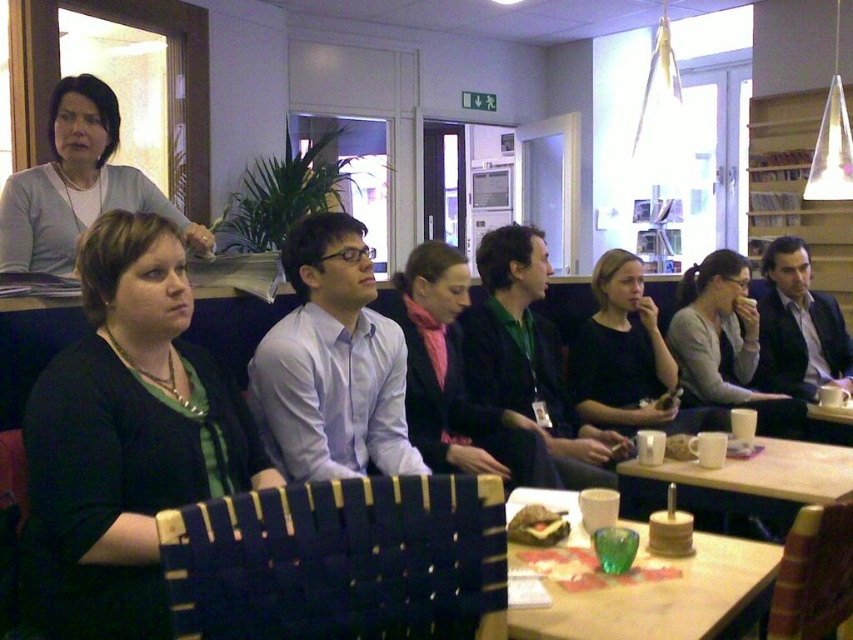
Based on the photo, does translucent green glass at lower center have a greater width compared to matte gray sweater at upper left?

In fact, translucent green glass at lower center might be narrower than matte gray sweater at upper left.

Can you confirm if translucent green glass at lower center is positioned above matte gray sweater at upper left?

No, translucent green glass at lower center is not above matte gray sweater at upper left.

This screenshot has height=640, width=853. In order to click on translucent green glass at lower center in this screenshot , I will do pos(662,596).

Does white ceramic cups at lower right have a smaller size compared to matte gray sweater at center?

Yes.

From the picture: Can you confirm if white ceramic cups at lower right is positioned above matte gray sweater at center?

No.

The height and width of the screenshot is (640, 853). Find the location of `white ceramic cups at lower right`. white ceramic cups at lower right is located at coordinates (741, 486).

Identify the location of white ceramic cups at lower right. (741, 486).

Describe the element at coordinates (627, 358) in the screenshot. The image size is (853, 640). I see `black matte shirt at center` at that location.

Who is more distant from viewer, (x=662, y=424) or (x=846, y=470)?

Point (x=662, y=424)

The width and height of the screenshot is (853, 640). What do you see at coordinates (627, 358) in the screenshot?
I see `black matte shirt at center` at bounding box center [627, 358].

Image resolution: width=853 pixels, height=640 pixels. I want to click on black matte shirt at center, so click(627, 358).